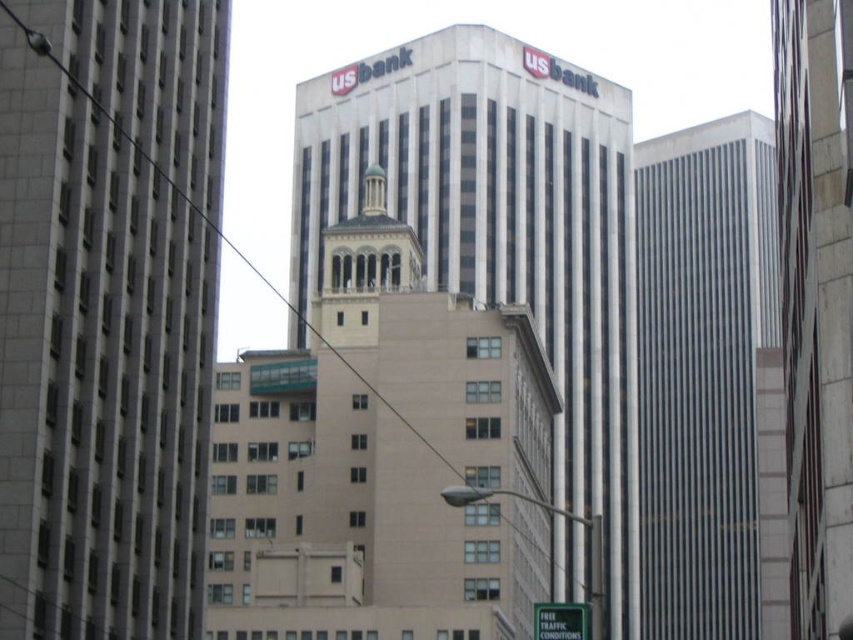
Question: Which point is farther from the camera taking this photo?

Choices:
 (A) (316, 275)
 (B) (819, 573)

Answer: (A)

Question: Is white glass building at center closer to camera compared to green matte traffic sign at lower center?

Choices:
 (A) yes
 (B) no

Answer: (B)

Question: Is gray concrete skyscraper at center to the left of white glass building at center from the viewer's perspective?

Choices:
 (A) yes
 (B) no

Answer: (A)

Question: Among these points, which one is farthest from the camera?

Choices:
 (A) pos(54,456)
 (B) pos(547,611)

Answer: (A)

Question: Which of these objects is positioned closest to the gray concrete skyscraper at center?

Choices:
 (A) green matte traffic sign at lower center
 (B) gray/vertical lines building at right
 (C) white glass building at center
 (D) smooth glass tower at right

Answer: (A)

Question: Does white glass building at center come in front of gray/vertical lines building at right?

Choices:
 (A) no
 (B) yes

Answer: (B)